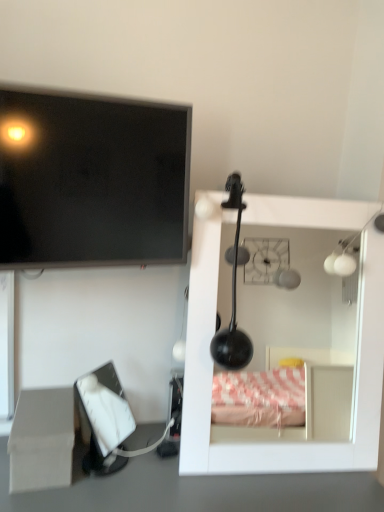
Locate an element on the screen. The width and height of the screenshot is (384, 512). white glossy mirror at upper right is located at coordinates (289, 340).

This screenshot has width=384, height=512. I want to click on white matte tissue box at lower left, so click(104, 419).

I want to click on matte black screen at upper left, so click(x=92, y=180).

Between beige cardboard box at lower left and white matte tissue box at lower left, which one appears on the right side from the viewer's perspective?

white matte tissue box at lower left is more to the right.

In terms of height, does beige cardboard box at lower left look taller or shorter compared to white matte tissue box at lower left?

beige cardboard box at lower left is shorter than white matte tissue box at lower left.

Is beige cardboard box at lower left turned away from white matte tissue box at lower left?

No, white matte tissue box at lower left is not at the back of beige cardboard box at lower left.

Locate an element on the screen. The width and height of the screenshot is (384, 512). television above the white glossy mirror at upper right (from a real-world perspective) is located at coordinates (92, 180).

Which is more to the right, white glossy mirror at upper right or matte black screen at upper left?

From the viewer's perspective, white glossy mirror at upper right appears more on the right side.

Does point (195, 419) come behind point (128, 254)?

Yes, point (195, 419) is farther from viewer.

From a real-world perspective, does white glossy mirror at upper right stand above matte black screen at upper left?

No, from a real-world perspective, white glossy mirror at upper right is not over matte black screen at upper left

Locate an element on the screen. The image size is (384, 512). cardboard box on the left of white glossy mirror at upper right is located at coordinates pos(42,439).

Considering the sizes of objects beige cardboard box at lower left and white glossy mirror at upper right in the image provided, who is shorter, beige cardboard box at lower left or white glossy mirror at upper right?

beige cardboard box at lower left.

In the scene shown: Is beige cardboard box at lower left with white glossy mirror at upper right?

No, beige cardboard box at lower left is not touching white glossy mirror at upper right.

Does point (47, 400) appear closer or farther from the camera than point (274, 326)?

Point (47, 400) is closer to the camera than point (274, 326).

Which object is further away from the camera, beige cardboard box at lower left or matte black screen at upper left?

beige cardboard box at lower left is behind.

Can you confirm if beige cardboard box at lower left is bigger than matte black screen at upper left?

Yes.

Between beige cardboard box at lower left and matte black screen at upper left, which one appears on the left side from the viewer's perspective?

From the viewer's perspective, beige cardboard box at lower left appears more on the left side.

Is beige cardboard box at lower left oriented away from matte black screen at upper left?

beige cardboard box at lower left is not turned away from matte black screen at upper left.

From a real-world perspective, who is located lower, white glossy mirror at upper right or beige cardboard box at lower left?

beige cardboard box at lower left, from a real-world perspective.

Visually, is white glossy mirror at upper right positioned to the left or to the right of beige cardboard box at lower left?

Clearly, white glossy mirror at upper right is on the right of beige cardboard box at lower left in the image.

Is the depth of white glossy mirror at upper right greater than that of beige cardboard box at lower left?

Yes, the depth of white glossy mirror at upper right is greater than that of beige cardboard box at lower left.

In the image, there is a white matte tissue box at lower left. Identify the location of furniture above it (from the image's perspective). (289, 340).

In terms of size, does white matte tissue box at lower left appear bigger or smaller than white glossy mirror at upper right?

Considering their sizes, white matte tissue box at lower left takes up less space than white glossy mirror at upper right.

Is the surface of white matte tissue box at lower left in direct contact with white glossy mirror at upper right?

No, white matte tissue box at lower left is not in contact with white glossy mirror at upper right.

Considering the relative positions of white matte tissue box at lower left and white glossy mirror at upper right in the image provided, is white matte tissue box at lower left to the left or to the right of white glossy mirror at upper right?

Based on their positions, white matte tissue box at lower left is located to the left of white glossy mirror at upper right.

Which object is positioned more to the right, white glossy mirror at upper right or white matte tissue box at lower left?

white glossy mirror at upper right.

From a real-world perspective, is white glossy mirror at upper right physically below white matte tissue box at lower left?

No, from a real-world perspective, white glossy mirror at upper right is not below white matte tissue box at lower left.

Where is `computer monitor below the white glossy mirror at upper right (from the image's perspective)`? The image size is (384, 512). computer monitor below the white glossy mirror at upper right (from the image's perspective) is located at coordinates (104, 419).

The image size is (384, 512). Identify the location of cardboard box in front of the white matte tissue box at lower left. (42, 439).

Find the location of `television above the white glossy mirror at upper right (from a real-world perspective)`. television above the white glossy mirror at upper right (from a real-world perspective) is located at coordinates (92, 180).

Looking at the image, which one is located closer to beige cardboard box at lower left, matte black screen at upper left or white matte tissue box at lower left?

Based on the image, white matte tissue box at lower left appears to be nearer to beige cardboard box at lower left.

Based on their spatial positions, is white matte tissue box at lower left or beige cardboard box at lower left closer to matte black screen at upper left?

Based on the image, beige cardboard box at lower left appears to be nearer to matte black screen at upper left.

Considering their positions, is white matte tissue box at lower left positioned closer to beige cardboard box at lower left than white glossy mirror at upper right?

Among the two, white matte tissue box at lower left is located nearer to beige cardboard box at lower left.

Estimate the real-world distances between objects in this image. Which object is closer to white glossy mirror at upper right, beige cardboard box at lower left or white matte tissue box at lower left?

white matte tissue box at lower left is positioned closer to the anchor white glossy mirror at upper right.

Based on their spatial positions, is matte black screen at upper left or beige cardboard box at lower left further from white matte tissue box at lower left?

matte black screen at upper left.

From the image, which object appears to be farther from matte black screen at upper left, beige cardboard box at lower left or white glossy mirror at upper right?

white glossy mirror at upper right is further to matte black screen at upper left.

Based on their spatial positions, is white glossy mirror at upper right or beige cardboard box at lower left further from white matte tissue box at lower left?

Based on the image, white glossy mirror at upper right appears to be further to white matte tissue box at lower left.

Based on their spatial positions, is beige cardboard box at lower left or white glossy mirror at upper right closer to white matte tissue box at lower left?

Based on the image, beige cardboard box at lower left appears to be nearer to white matte tissue box at lower left.

You are a GUI agent. You are given a task and a screenshot of the screen. Output one action in this format:
    pyautogui.click(x=<x>, y=<y>)
    Task: Click on the computer monitor between beige cardboard box at lower left and white glossy mirror at upper right from left to right
    
    Given the screenshot: What is the action you would take?
    pyautogui.click(x=104, y=419)

Locate an element on the screen. This screenshot has height=512, width=384. television situated between beige cardboard box at lower left and white glossy mirror at upper right from left to right is located at coordinates (92, 180).

You are a GUI agent. You are given a task and a screenshot of the screen. Output one action in this format:
    pyautogui.click(x=<x>, y=<y>)
    Task: Click on the computer monitor between matte black screen at upper left and beige cardboard box at lower left in the vertical direction
    The height and width of the screenshot is (512, 384).
    Given the screenshot: What is the action you would take?
    pyautogui.click(x=104, y=419)

This screenshot has height=512, width=384. Find the location of `furniture that lies between matte black screen at upper left and white matte tissue box at lower left from top to bottom`. furniture that lies between matte black screen at upper left and white matte tissue box at lower left from top to bottom is located at coordinates (289, 340).